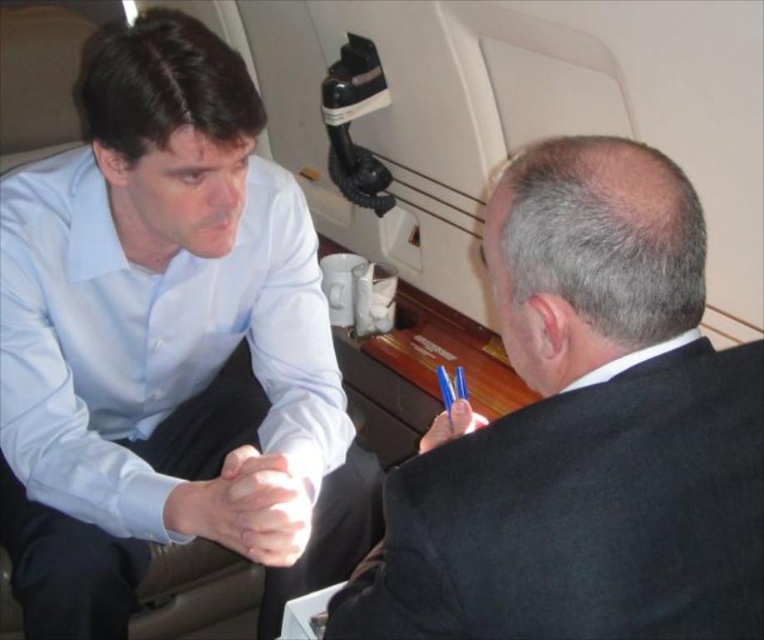
You are a flight attendant on a private jet. You need to retrieve an item from the cabin. There are two points marked in the cabin. One is at point coordinates point (60, 493) and the other is at point coordinates point (630, 388). Which point is located behind the other?

Point (60, 493) is behind point (630, 388).

You are a flight attendant on a private jet. You need to deliver a drink to both the person in the light blue shirt at upper left and the person in the black matte suit at right. Which passenger should you serve first if you want to follow the standard protocol of serving from left to right?

The standard protocol on aircraft typically involves serving passengers from left to right. Since the light blue shirt at upper left is positioned to the left of the black matte suit at right, you should serve the passenger in the light blue shirt at upper left first.